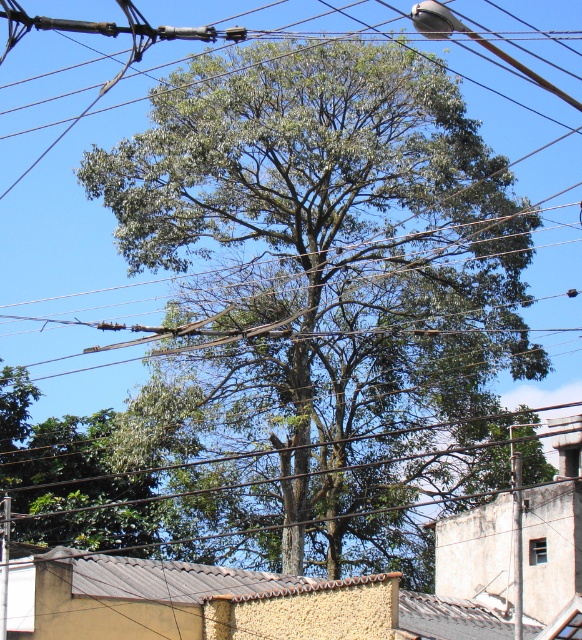
Does point (306, 172) come behind point (3, 625)?

Yes, it is.

This screenshot has width=582, height=640. In order to click on green leafy tree at center in this screenshot , I will do `click(328, 292)`.

Does point (225, 109) lie behind point (5, 584)?

Yes, point (225, 109) is behind point (5, 584).

You are a GUI agent. You are given a task and a screenshot of the screen. Output one action in this format:
    pyautogui.click(x=<x>, y=<y>)
    Task: Click on the green leafy tree at center
    
    Given the screenshot: What is the action you would take?
    [328, 292]